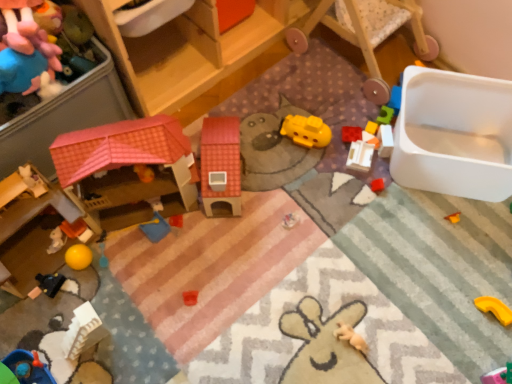
I want to click on free space that is in between yellow matte submarine at center, the 7th toy when ordered from right to left, and blue fabric toy at center, acting as the ninth toy starting from the right, so click(x=250, y=175).